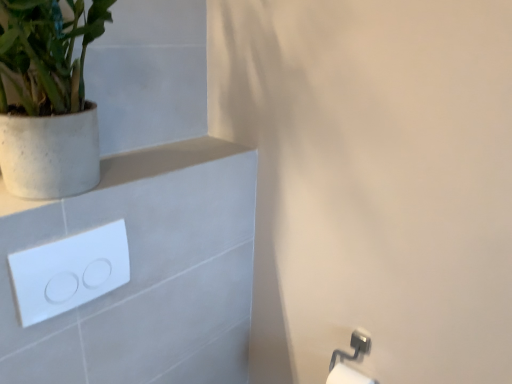
Identify the location of blank space situated above white matte concrete at upper left (from a real-world perspective). Image resolution: width=512 pixels, height=384 pixels. coord(158,155).